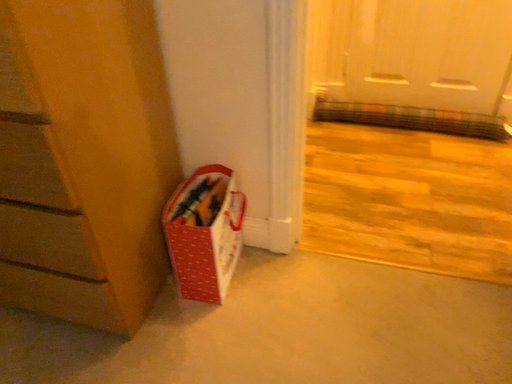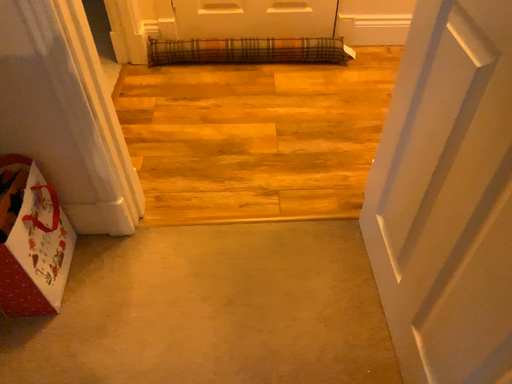
Question: How did the camera likely rotate when shooting the video?

Choices:
 (A) rotated left
 (B) rotated right

Answer: (B)